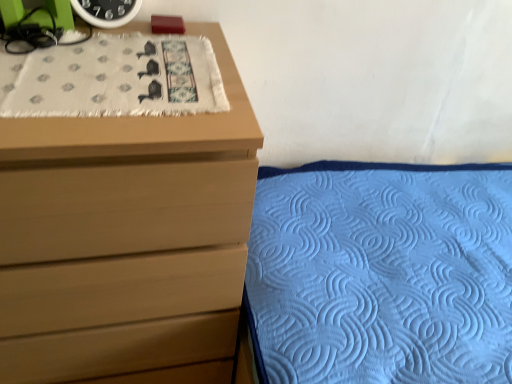
Locate an element on the screen. This screenshot has width=512, height=384. free space in front of green matte clock at upper left is located at coordinates point(87,56).